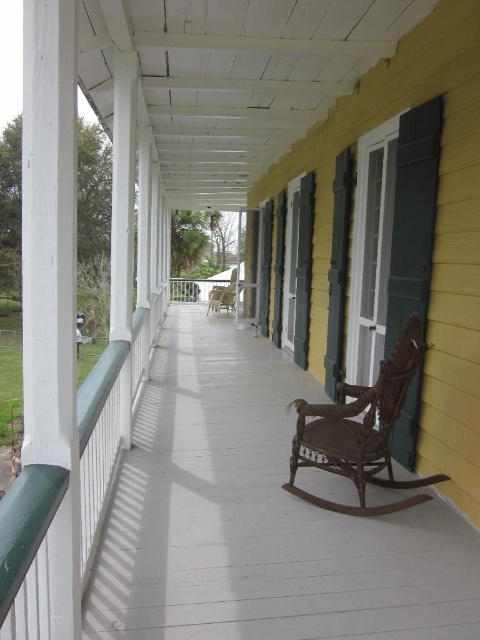
Question: Is white painted wood porch at center to the right of wooden rocking chair at center from the viewer's perspective?

Choices:
 (A) yes
 (B) no

Answer: (A)

Question: Considering the real-world distances, which object is farthest from the white painted wood porch at center?

Choices:
 (A) wooden rocking chair at center
 (B) brown wicker rocking chair at center-right

Answer: (A)

Question: Which point is farther to the camera?

Choices:
 (A) white painted wood porch at center
 (B) brown wicker rocking chair at center-right
 (C) wooden rocking chair at center

Answer: (C)

Question: From the image, what is the correct spatial relationship of white painted wood porch at center in relation to wooden rocking chair at center?

Choices:
 (A) below
 (B) above

Answer: (A)

Question: Estimate the real-world distances between objects in this image. Which object is farther from the white painted wood porch at center?

Choices:
 (A) wooden rocking chair at center
 (B) brown wicker rocking chair at center-right

Answer: (A)

Question: Observing the image, what is the correct spatial positioning of white painted wood porch at center in reference to brown wicker rocking chair at center-right?

Choices:
 (A) right
 (B) left

Answer: (B)